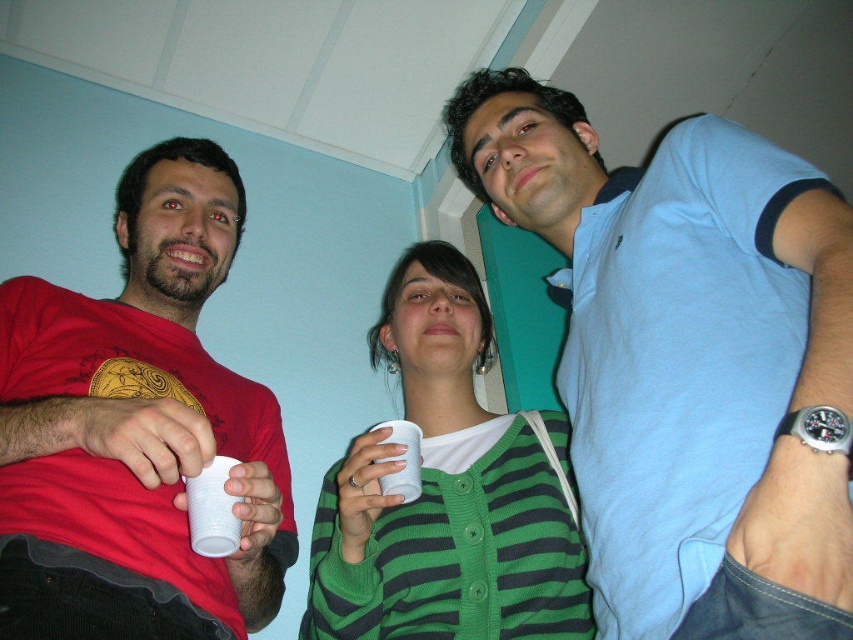
Question: Which object is positioned closest to the matte red t-shirt at left?

Choices:
 (A) white plastic cup at lower left
 (B) white plastic cup at center

Answer: (A)

Question: From the image, what is the correct spatial relationship of light blue cotton shirt at upper right in relation to white plastic cup at center?

Choices:
 (A) left
 (B) right

Answer: (B)

Question: Which point is closer to the camera taking this photo?

Choices:
 (A) (218, 525)
 (B) (560, 184)
 (C) (386, 426)

Answer: (A)

Question: Is matte red t-shirt at left in front of white plastic cup at lower left?

Choices:
 (A) yes
 (B) no

Answer: (A)

Question: Is white plastic cup at lower left wider than white plastic cup at center?

Choices:
 (A) yes
 (B) no

Answer: (B)

Question: Which of the following is the closest to the observer?

Choices:
 (A) (555, 138)
 (B) (219, 476)

Answer: (B)